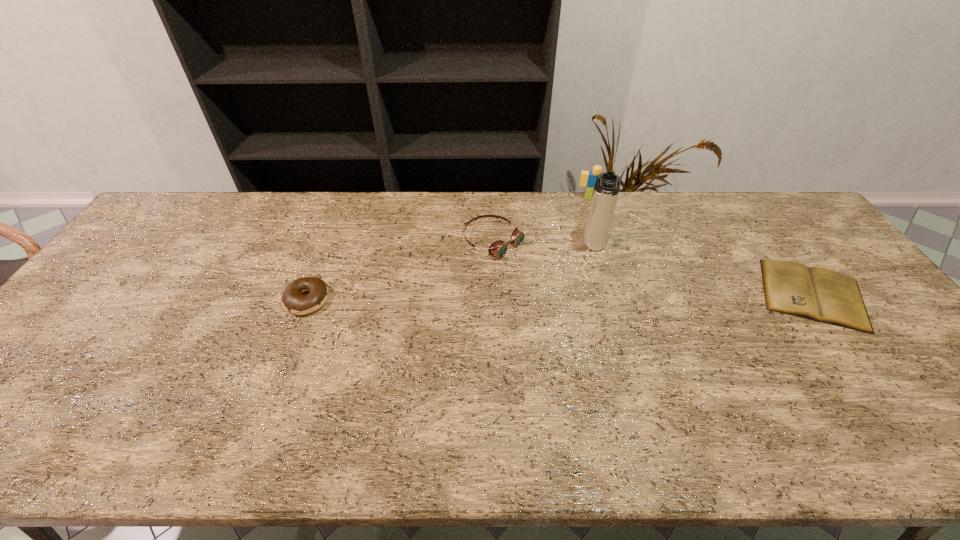
Where is `vacant region located on the back of the book`? This screenshot has height=540, width=960. vacant region located on the back of the book is located at coordinates (779, 247).

Find the location of a particular element. Image resolution: width=960 pixels, height=540 pixels. vacant area situated on the handle side of the tallest object is located at coordinates (581, 345).

Image resolution: width=960 pixels, height=540 pixels. What are the coordinates of `vacant space located 0.140m on the handle side of the tallest object` in the screenshot? It's located at (589, 292).

You are a GUI agent. You are given a task and a screenshot of the screen. Output one action in this format:
    pyautogui.click(x=<x>, y=<y>)
    Task: Click on the free space located 0.390m on the handle side of the tallest object
    Image resolution: width=960 pixels, height=540 pixels.
    Given the screenshot: What is the action you would take?
    pyautogui.click(x=578, y=364)

Locate an element on the screen. This screenshot has width=960, height=540. vacant position located 0.090m through the lenses of the third tallest object is located at coordinates (540, 271).

You are a GUI agent. You are given a task and a screenshot of the screen. Output one action in this format:
    pyautogui.click(x=<x>, y=<y>)
    Task: Click on the free location located through the lenses of the third tallest object
    
    Given the screenshot: What is the action you would take?
    pyautogui.click(x=599, y=308)

I want to click on vacant space located through the lenses of the third tallest object, so click(x=572, y=292).

Where is `free space located on the face of the Lego`? free space located on the face of the Lego is located at coordinates (588, 230).

The width and height of the screenshot is (960, 540). I want to click on vacant space located 0.060m on the face of the Lego, so click(x=589, y=212).

What are the coordinates of `vacant area located 0.380m on the face of the Lego` in the screenshot? It's located at (586, 276).